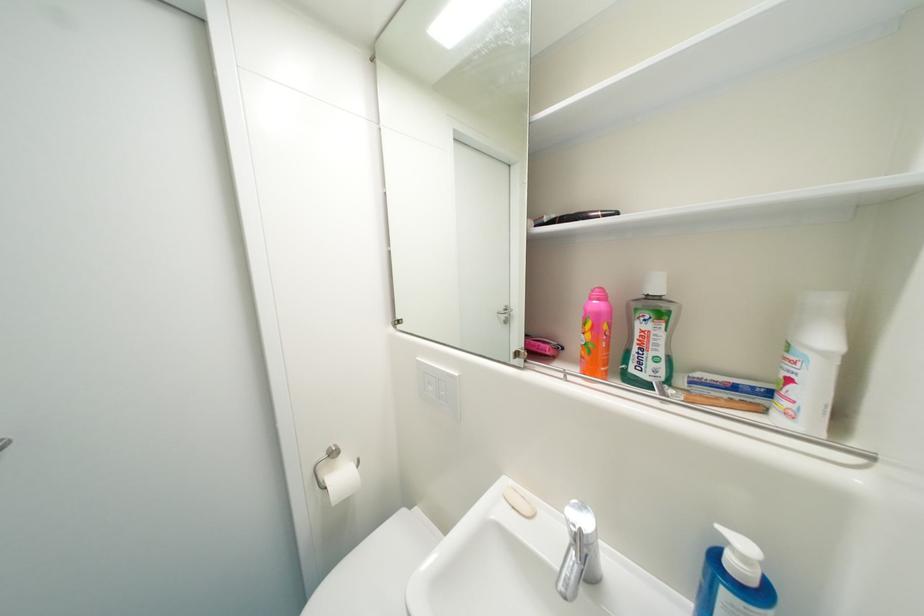
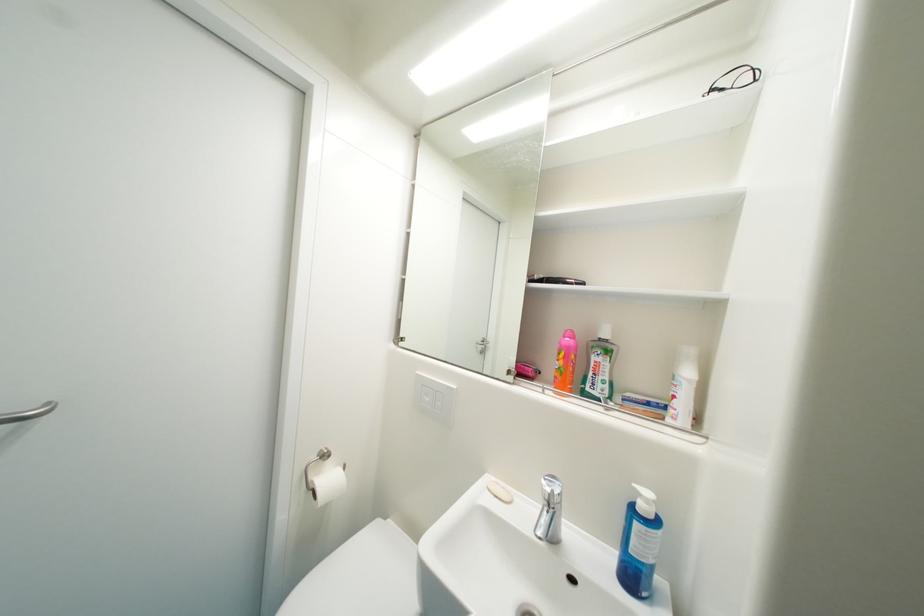
Where in the second image is the point corresponding to point (704, 377) from the first image?

(635, 397)